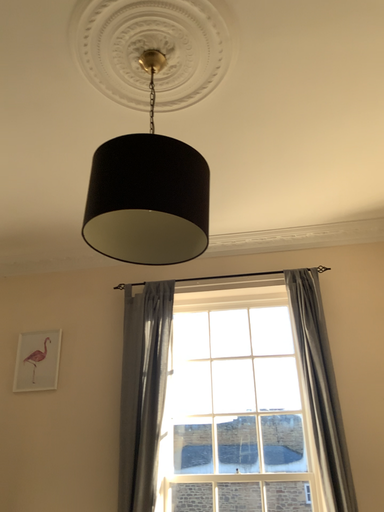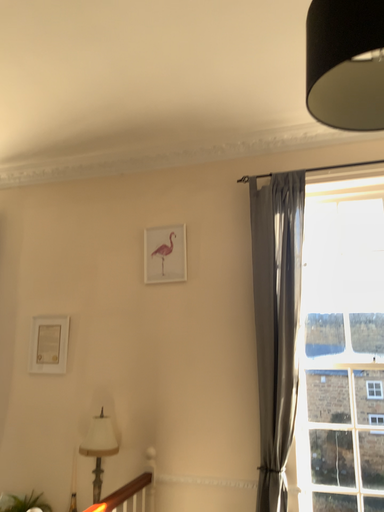
Question: How did the camera likely rotate when shooting the video?

Choices:
 (A) rotated upward
 (B) rotated downward

Answer: (B)